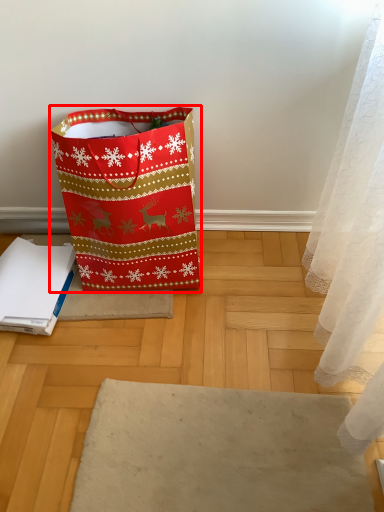
Question: From the image, what is the correct spatial relationship of luggage and bags (annotated by the red box) in relation to notebook?

Choices:
 (A) left
 (B) right

Answer: (B)